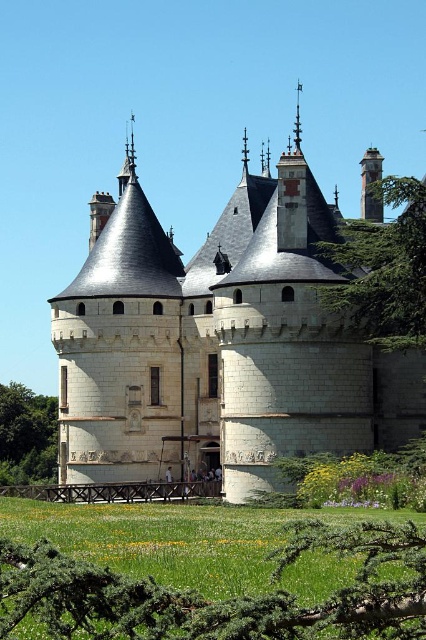
Question: Can you confirm if white stone castle at center is wider than green leafy tree at left?

Choices:
 (A) yes
 (B) no

Answer: (A)

Question: Which object is farther from the camera taking this photo?

Choices:
 (A) green grass at lower center
 (B) white stone castle at center
 (C) dark gray stone tower at upper right
 (D) green leafy tree at left

Answer: (D)

Question: Is green grass at lower center closer to camera compared to green leafy tree at upper center?

Choices:
 (A) yes
 (B) no

Answer: (A)

Question: Does green grass at lower center have a larger size compared to green leafy tree at upper center?

Choices:
 (A) no
 (B) yes

Answer: (B)

Question: Which object appears closest to the camera in this image?

Choices:
 (A) green leafy tree at upper center
 (B) white stone castle at center
 (C) green leafy tree at left
 (D) dark gray stone tower at upper right

Answer: (A)

Question: Which object is farther from the camera taking this photo?

Choices:
 (A) white stone castle at center
 (B) green leafy tree at upper center
 (C) green leafy tree at left
 (D) dark gray stone tower at upper right

Answer: (C)